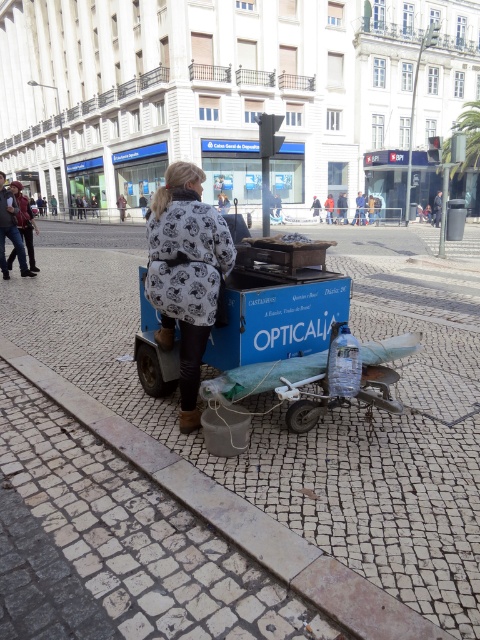
Can you confirm if cobblestone pavement at center is positioned to the right of white printed coat at center?

Yes, cobblestone pavement at center is to the right of white printed coat at center.

Which of these two, cobblestone pavement at center or white printed coat at center, stands taller?

With more height is cobblestone pavement at center.

Who is more distant from viewer, (x=436, y=525) or (x=177, y=172)?

Positioned behind is point (x=177, y=172).

Identify the location of cobblestone pavement at center. (320, 420).